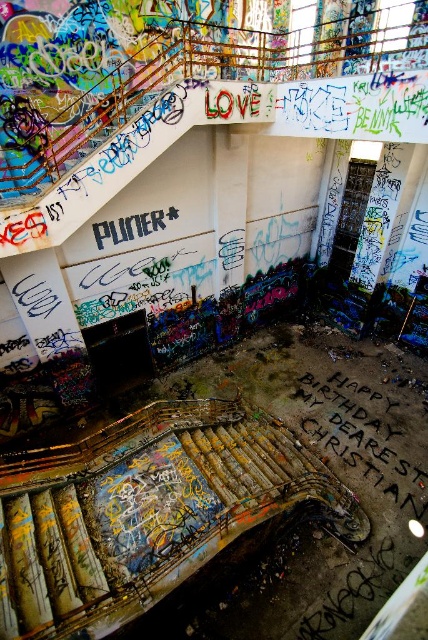
You are standing in the dilapidated building and want to move from the rusty metal stairs at center to the black chalk writing at center. In which direction should you move?

The rusty metal stairs at center is to the left of black chalk writing at center, so you should move to the right to reach the black chalk writing at center from the rusty metal stairs at center.

You are an inspector trying to assess the structural integrity of the building. You notice the rusty metal stairs at center and the black chalk writing at center. Which object would you prioritize inspecting first based on their width?

The rusty metal stairs at center is thinner than the black chalk writing at center, so you should prioritize inspecting the rusty metal stairs at center first because thinner structures may be weaker and pose a higher risk of failure.